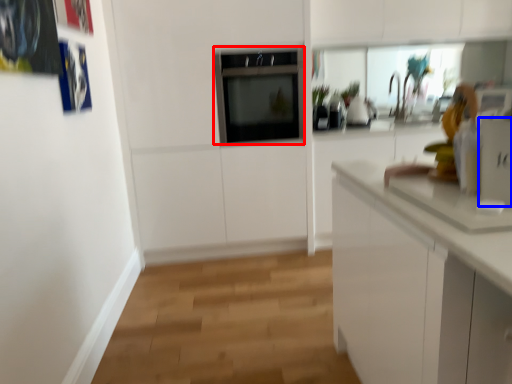
Question: Which of the following is the farthest to the observer, oven (highlighted by a red box) or appliance (highlighted by a blue box)?

Choices:
 (A) oven
 (B) appliance

Answer: (A)